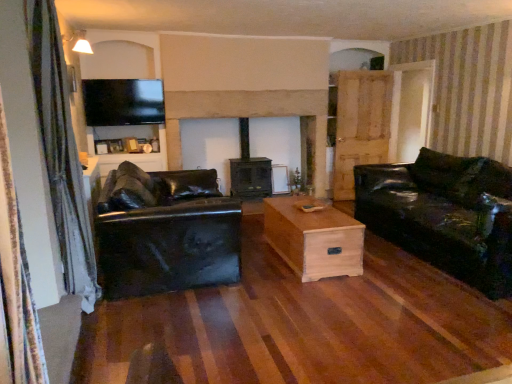
This screenshot has height=384, width=512. I want to click on free location to the right of silky blue curtain at left, so point(127,325).